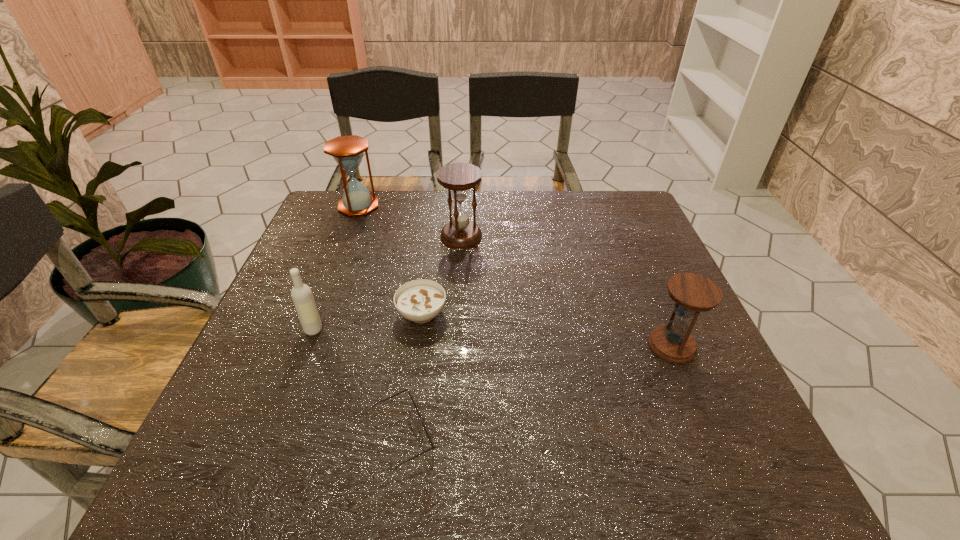
The image size is (960, 540). What are the coordinates of `free space between the second farthest object and the vodka` in the screenshot? It's located at (388, 283).

Locate an element on the screen. The width and height of the screenshot is (960, 540). vacant space that is in between the spectacles and the nearest hourglass is located at coordinates (538, 390).

Locate an element on the screen. free space between the vodka and the second shortest object is located at coordinates (368, 322).

This screenshot has height=540, width=960. Find the location of `free space between the leftmost hourglass and the second shortest object`. free space between the leftmost hourglass and the second shortest object is located at coordinates (390, 260).

This screenshot has height=540, width=960. What are the coordinates of `free point between the vodka and the shortest object` in the screenshot? It's located at (358, 382).

You are a GUI agent. You are given a task and a screenshot of the screen. Output one action in this format:
    pyautogui.click(x=<x>, y=<y>)
    Task: Click on the empty space that is in between the vodka and the rightmost object
    The height and width of the screenshot is (540, 960).
    Given the screenshot: What is the action you would take?
    pyautogui.click(x=492, y=338)

Find the location of a particular element. This screenshot has width=960, height=540. vacant area that lies between the second hourglass from left to right and the fifth tallest object is located at coordinates (442, 275).

Point out which object is positioned as the third nearest to the shortest hourglass. Please provide its 2D coordinates. Your answer should be formatted as a tuple, i.e. [(x, y)], where the tuple contains the x and y coordinates of a point satisfying the conditions above.

[(461, 233)]

Where is `the third closest object relative to the vodka`? the third closest object relative to the vodka is located at coordinates (461, 233).

The image size is (960, 540). I want to click on the third closest hourglass to the soup bowl, so click(x=692, y=293).